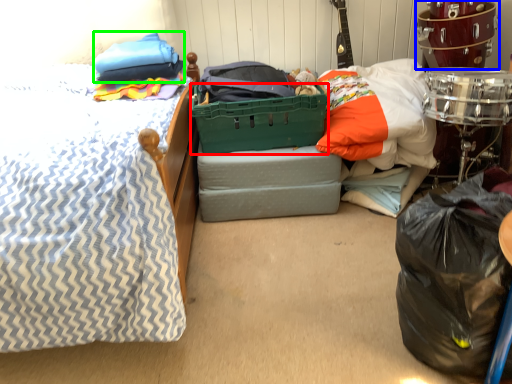
Question: Considering the real-world distances, which object is closest to basket (highlighted by a red box)? drum (highlighted by a blue box) or pillow (highlighted by a green box).

Choices:
 (A) drum
 (B) pillow

Answer: (B)